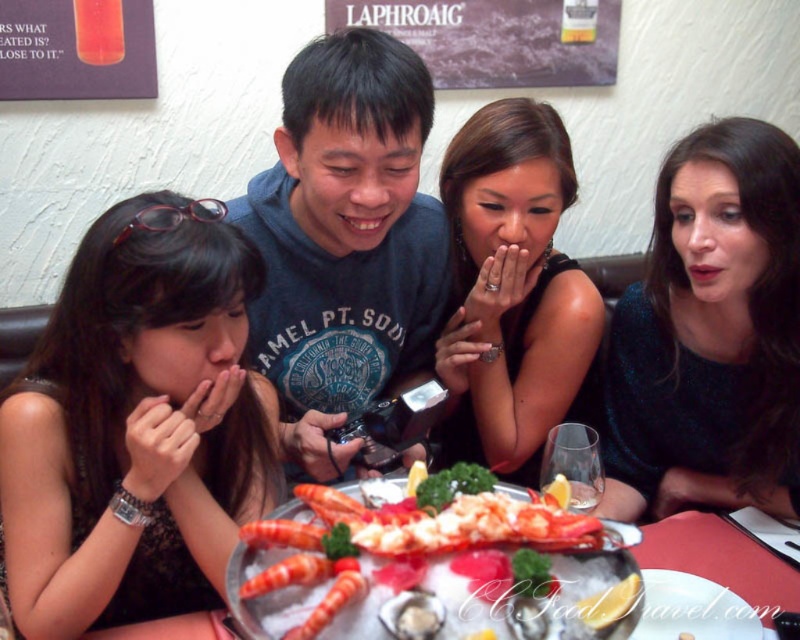
Does matte black dress at left appear on the left side of shiny silver tray at center?

Correct, you'll find matte black dress at left to the left of shiny silver tray at center.

Can you confirm if matte black dress at left is positioned below shiny silver tray at center?

Incorrect, matte black dress at left is not positioned below shiny silver tray at center.

You are a GUI agent. You are given a task and a screenshot of the screen. Output one action in this format:
    pyautogui.click(x=<x>, y=<y>)
    Task: Click on the matte black dress at left
    
    Given the screenshot: What is the action you would take?
    pyautogui.click(x=136, y=424)

Which is more to the right, matte black dress at left or shiny red lobster at center?

shiny red lobster at center

Which is more to the left, matte black dress at left or shiny red lobster at center?

From the viewer's perspective, matte black dress at left appears more on the left side.

Does point (226, 224) come in front of point (505, 556)?

No, (226, 224) is behind (505, 556).

This screenshot has width=800, height=640. In order to click on matte black dress at left in this screenshot , I will do `click(136, 424)`.

Between matte black dress at left and sparkly blue dress at right, which one appears on the right side from the viewer's perspective?

sparkly blue dress at right is more to the right.

Can you confirm if matte black dress at left is thinner than sparkly blue dress at right?

In fact, matte black dress at left might be wider than sparkly blue dress at right.

Is point (154, 554) farther from viewer compared to point (670, 193)?

No.

The width and height of the screenshot is (800, 640). I want to click on matte black dress at left, so click(x=136, y=424).